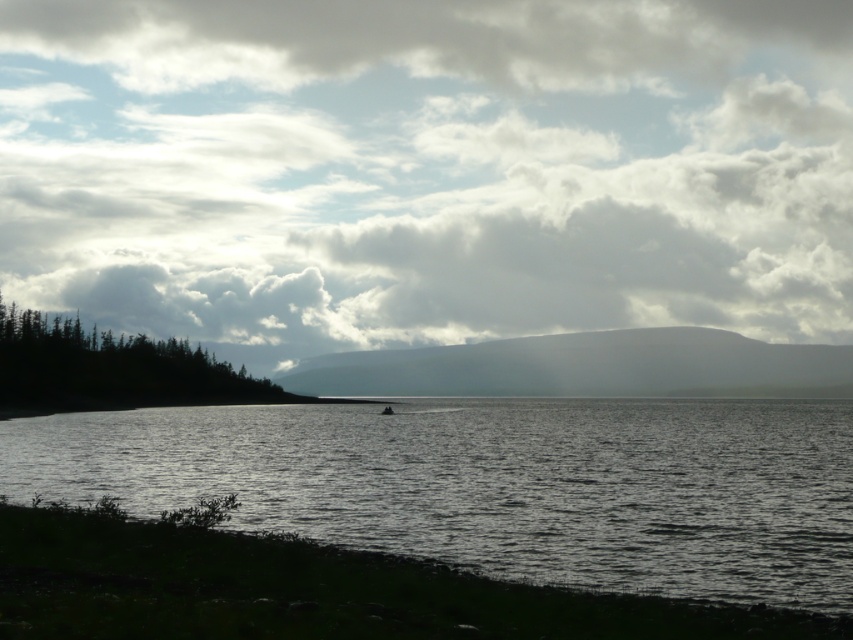
Does dark reflective water at center appear under dark green textured trees at lower left?

Yes.

Describe the element at coordinates (496, 484) in the screenshot. The height and width of the screenshot is (640, 853). I see `dark reflective water at center` at that location.

Identify the location of dark reflective water at center. The height and width of the screenshot is (640, 853). (496, 484).

Is point (328, 588) farther from camera compared to point (381, 412)?

No.

Can you confirm if green grass at lower left is positioned to the right of dark gray metallic boat at center?

Indeed, green grass at lower left is positioned on the right side of dark gray metallic boat at center.

Is point (786, 628) less distant than point (387, 410)?

Yes, point (786, 628) is closer to viewer.

In order to click on green grass at lower left in this screenshot , I will do `click(309, 589)`.

Is green grass at lower left further to the viewer compared to dark green textured trees at lower left?

No, it is in front of dark green textured trees at lower left.

Is point (311, 616) farther from viewer compared to point (227, 401)?

No, (311, 616) is in front of (227, 401).

Where is `green grass at lower left`? green grass at lower left is located at coordinates (309, 589).